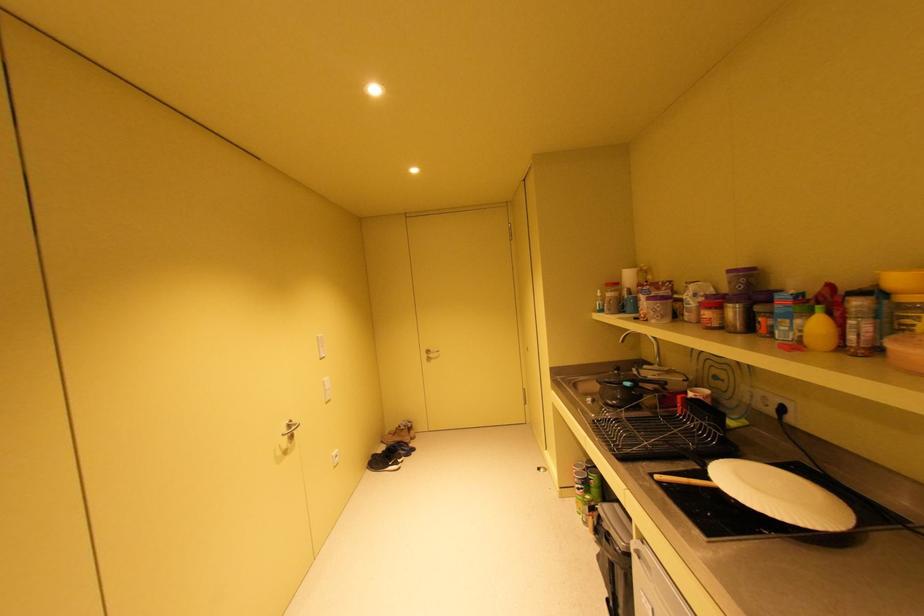
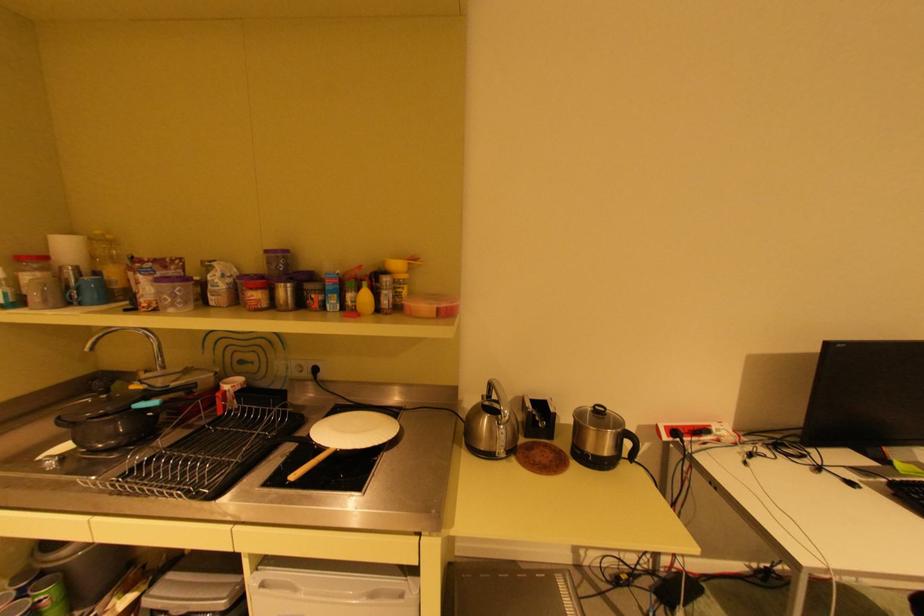
In the second image, find the point that corresponds to pixel 715 314 in the first image.

(264, 294)